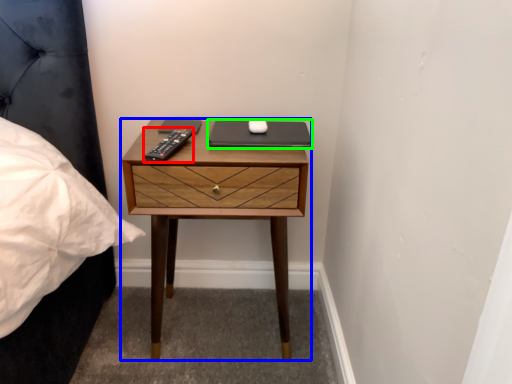
Question: Which is farther away from remote (highlighted by a red box)? nightstand (highlighted by a blue box) or laptop (highlighted by a green box)?

Choices:
 (A) nightstand
 (B) laptop

Answer: (A)